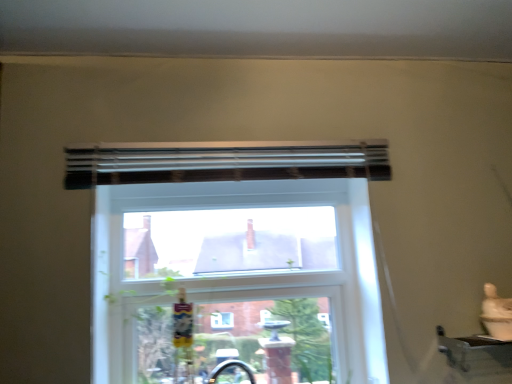
Question: Is clear glass window at center in contact with black matte curtain at upper center?

Choices:
 (A) no
 (B) yes

Answer: (A)

Question: Is clear glass window at center oriented away from black matte curtain at upper center?

Choices:
 (A) yes
 (B) no

Answer: (B)

Question: Is clear glass window at center bigger than black matte curtain at upper center?

Choices:
 (A) no
 (B) yes

Answer: (B)

Question: From the image's perspective, does clear glass window at center appear lower than black matte curtain at upper center?

Choices:
 (A) yes
 (B) no

Answer: (A)

Question: Is clear glass window at center to the right of black matte curtain at upper center from the viewer's perspective?

Choices:
 (A) yes
 (B) no

Answer: (B)

Question: Does clear glass window at center have a smaller size compared to black matte curtain at upper center?

Choices:
 (A) no
 (B) yes

Answer: (A)

Question: Is black matte curtain at upper center located within metallic silver window sill at lower right?

Choices:
 (A) no
 (B) yes

Answer: (A)

Question: Considering the relative positions of metallic silver window sill at lower right and black matte curtain at upper center in the image provided, is metallic silver window sill at lower right to the left of black matte curtain at upper center from the viewer's perspective?

Choices:
 (A) yes
 (B) no

Answer: (B)

Question: Can you confirm if metallic silver window sill at lower right is positioned to the right of black matte curtain at upper center?

Choices:
 (A) yes
 (B) no

Answer: (A)

Question: Is there a large distance between metallic silver window sill at lower right and black matte curtain at upper center?

Choices:
 (A) yes
 (B) no

Answer: (B)

Question: From the image's perspective, is metallic silver window sill at lower right over black matte curtain at upper center?

Choices:
 (A) yes
 (B) no

Answer: (B)

Question: Does metallic silver window sill at lower right have a smaller size compared to black matte curtain at upper center?

Choices:
 (A) no
 (B) yes

Answer: (B)

Question: Is black matte curtain at upper center bigger than clear glass window at center?

Choices:
 (A) yes
 (B) no

Answer: (B)